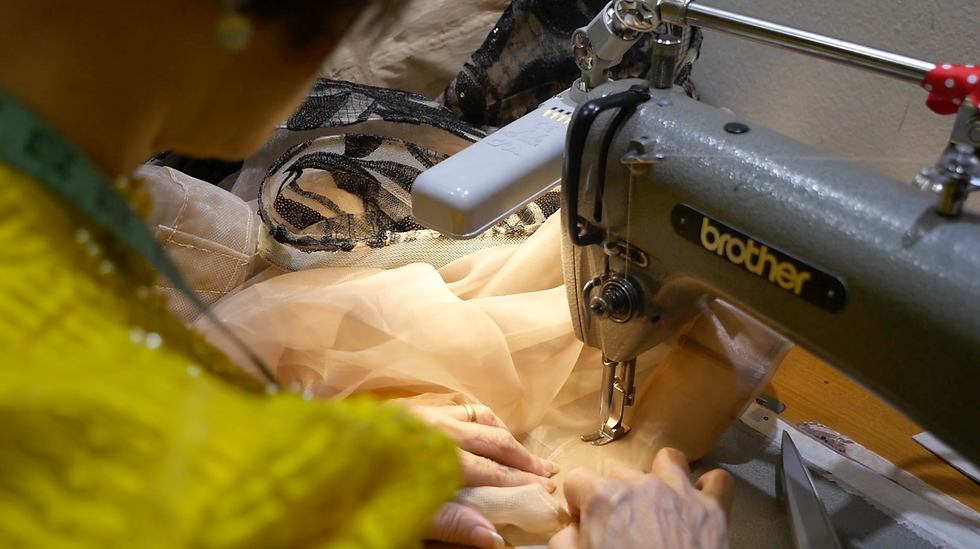
Identify the location of lamp. (468, 189).